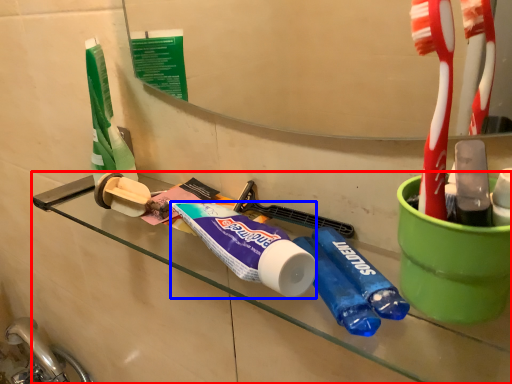
Question: Which object appears farthest to the camera in this image, counter (highlighted by a red box) or toothpaste (highlighted by a blue box)?

Choices:
 (A) counter
 (B) toothpaste

Answer: (B)